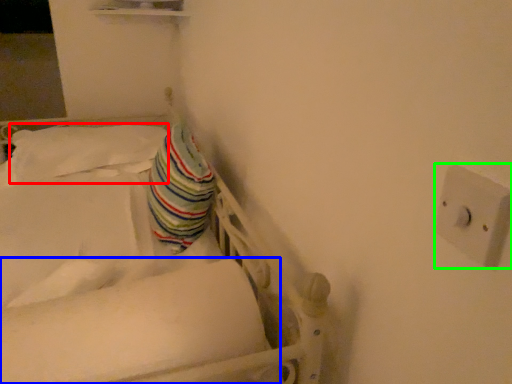
Question: Which is nearer to the pillow (highlighted by a red box)? mattress (highlighted by a blue box) or electric outlet (highlighted by a green box).

Choices:
 (A) mattress
 (B) electric outlet

Answer: (A)